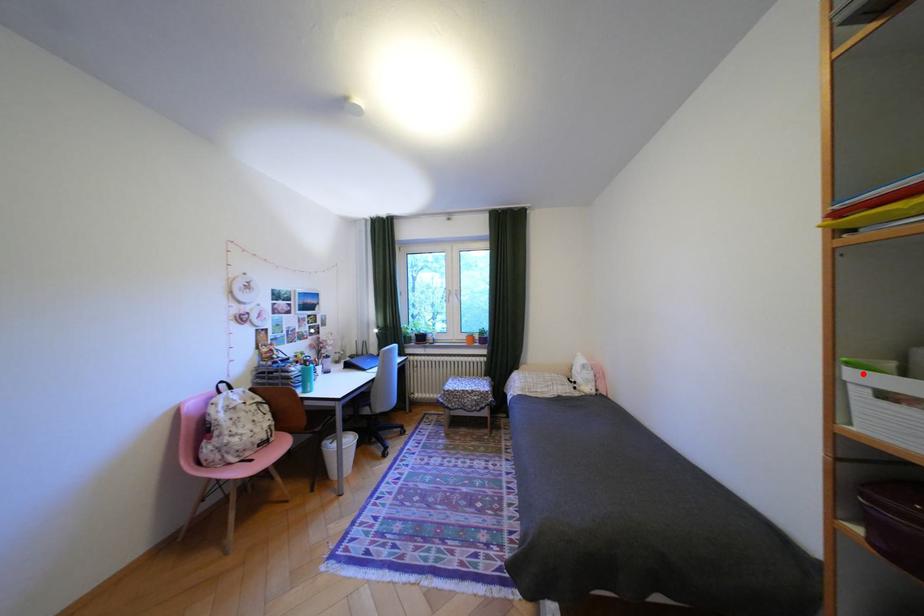
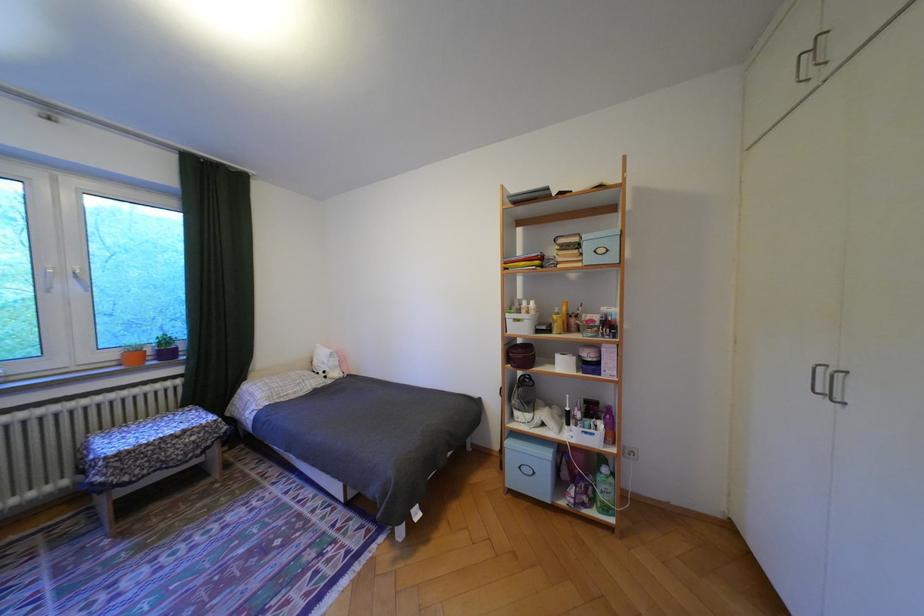
Find the pixel in the second image that matches the highlighted location in the first image.

(518, 315)